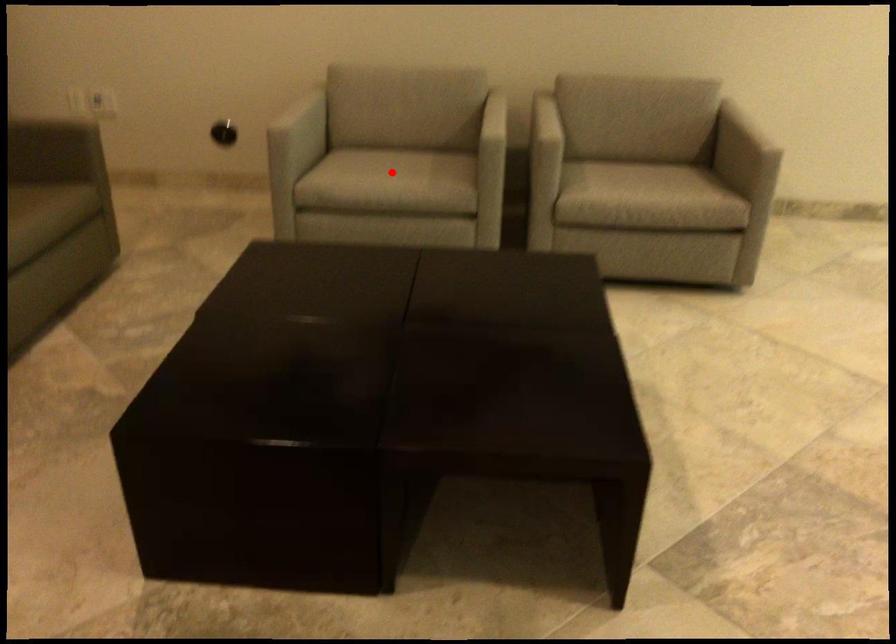
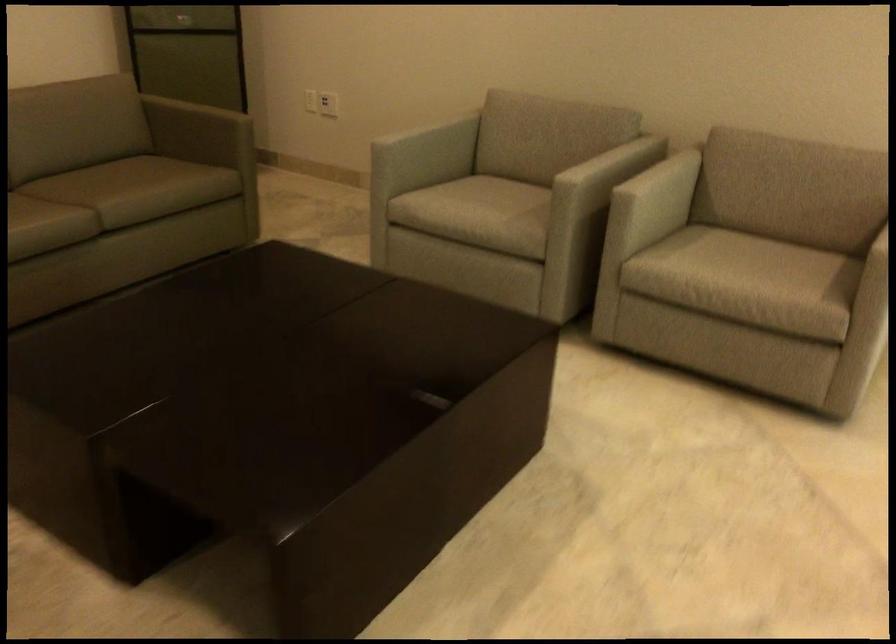
Where in the second image is the point corresponding to the highlighted location from the first image?

(480, 207)